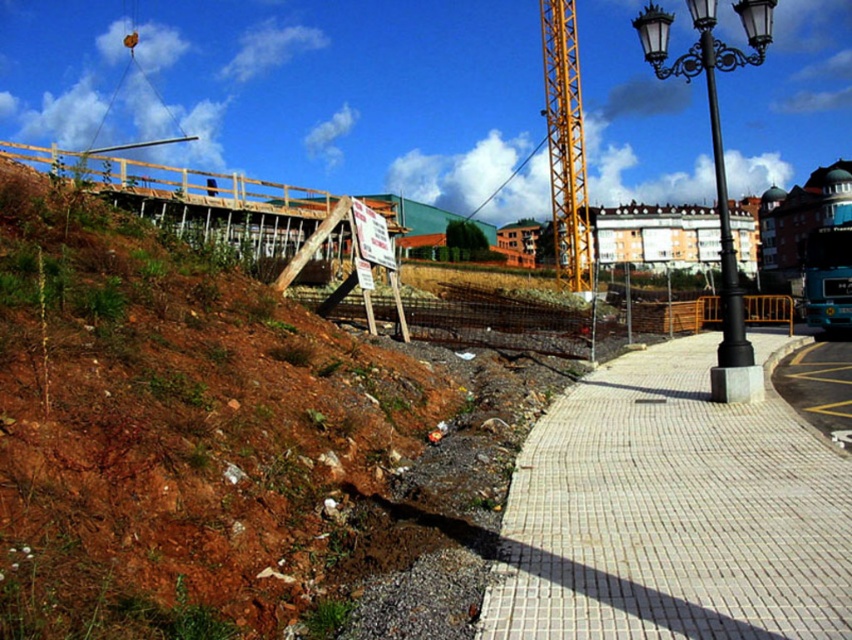
Does white brick pavement at lower right have a greater height compared to yellow metallic crane at center?

No.

Is point (582, 440) farther from camera compared to point (574, 104)?

No, (582, 440) is closer to viewer.

The height and width of the screenshot is (640, 852). What do you see at coordinates (671, 513) in the screenshot? I see `white brick pavement at lower right` at bounding box center [671, 513].

Where is `white brick pavement at lower right`? Image resolution: width=852 pixels, height=640 pixels. white brick pavement at lower right is located at coordinates (671, 513).

Between black metal streetlight at right and yellow metallic crane at center, which one has less height?

yellow metallic crane at center

Who is more forward, [717,193] or [580,221]?

Positioned in front is point [580,221].

What are the coordinates of `black metal streetlight at right` in the screenshot? It's located at (717, 164).

Does white brick pavement at lower right have a smaller size compared to black metal streetlight at right?

Indeed, white brick pavement at lower right has a smaller size compared to black metal streetlight at right.

You are a GUI agent. You are given a task and a screenshot of the screen. Output one action in this format:
    pyautogui.click(x=<x>, y=<y>)
    Task: Click on the white brick pavement at lower right
    The image size is (852, 640).
    Given the screenshot: What is the action you would take?
    pyautogui.click(x=671, y=513)